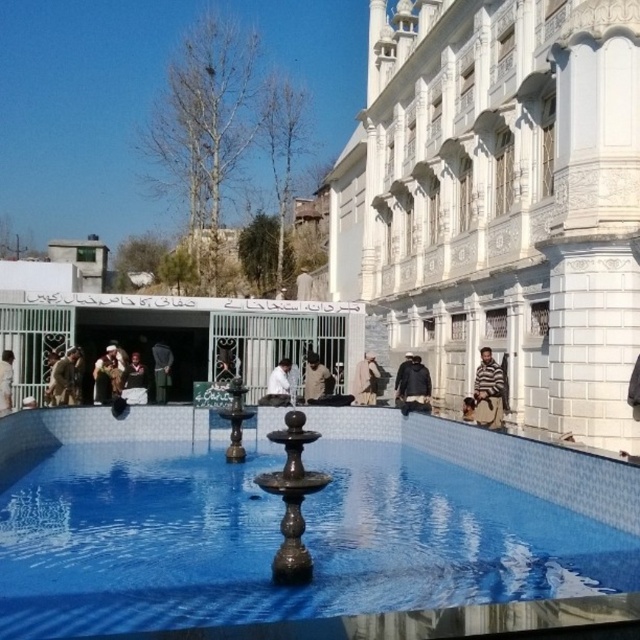
Question: Is dark green fabric at center positioned at the back of white fabric at center?

Choices:
 (A) yes
 (B) no

Answer: (A)

Question: Based on their relative distances, which object is nearer to the camouflage fabric jacket at left?

Choices:
 (A) striped sweater at right
 (B) beige woolen coat at center
 (C) striped fabric person at right
 (D) blue glossy water at center

Answer: (D)

Question: Considering the relative positions of brown fabric person at center and brown fabric person at lower left in the image provided, where is brown fabric person at center located with respect to brown fabric person at lower left?

Choices:
 (A) below
 (B) above

Answer: (A)

Question: Does dark brown leather jacket at center have a smaller size compared to striped sweater at right?

Choices:
 (A) no
 (B) yes

Answer: (A)

Question: Which object appears farthest from the camera in this image?

Choices:
 (A) dark brown leather jacket at center
 (B) brown fabric person at center
 (C) white fabric at center

Answer: (B)

Question: Estimate the real-world distances between objects in this image. Which object is farther from the beige woolen coat at center?

Choices:
 (A) dark brown leather jacket at center
 (B) brown fabric person at center
 (C) striped sweater at right

Answer: (C)